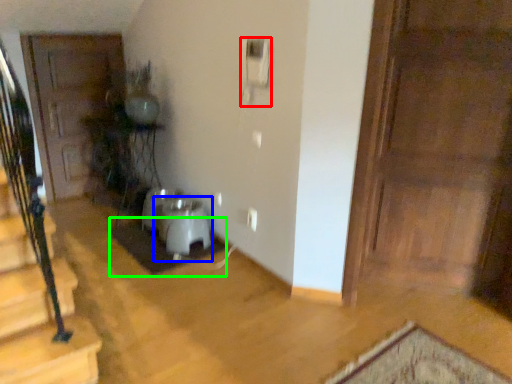
Question: Which is nearer to the corded phone (highlighted by a red box)? water heater (highlighted by a blue box) or doormat (highlighted by a green box).

Choices:
 (A) water heater
 (B) doormat

Answer: (A)